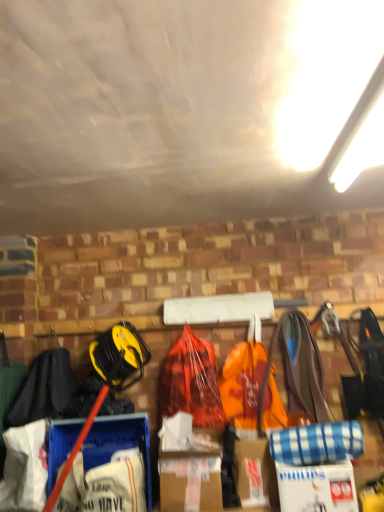
Question: Is white cardboard box at lower right wider than orange plastic bag at center?

Choices:
 (A) yes
 (B) no

Answer: (A)

Question: From the image's perspective, is white cardboard box at lower right on top of orange plastic bag at center?

Choices:
 (A) yes
 (B) no

Answer: (B)

Question: Is orange plastic bag at center at the back of white cardboard box at lower right?

Choices:
 (A) yes
 (B) no

Answer: (B)

Question: Considering the relative positions of white cardboard box at lower right and orange plastic bag at center in the image provided, is white cardboard box at lower right to the left of orange plastic bag at center from the viewer's perspective?

Choices:
 (A) yes
 (B) no

Answer: (B)

Question: Is white cardboard box at lower right bigger than orange plastic bag at center?

Choices:
 (A) no
 (B) yes

Answer: (A)

Question: From a real-world perspective, is white cardboard box at lower right on orange plastic bag at center?

Choices:
 (A) no
 (B) yes

Answer: (A)

Question: Is orange plastic bag at center closer to camera compared to white cardboard box at lower right?

Choices:
 (A) no
 (B) yes

Answer: (A)

Question: Is orange plastic bag at center outside white cardboard box at lower right?

Choices:
 (A) yes
 (B) no

Answer: (A)

Question: From a real-world perspective, is orange plastic bag at center on white cardboard box at lower right?

Choices:
 (A) yes
 (B) no

Answer: (A)

Question: Considering the relative positions of orange plastic bag at center and white cardboard box at lower right in the image provided, is orange plastic bag at center to the left of white cardboard box at lower right from the viewer's perspective?

Choices:
 (A) yes
 (B) no

Answer: (A)

Question: Considering the relative sizes of orange plastic bag at center and white cardboard box at lower right in the image provided, is orange plastic bag at center bigger than white cardboard box at lower right?

Choices:
 (A) no
 (B) yes

Answer: (B)

Question: From the image's perspective, would you say orange plastic bag at center is shown under white cardboard box at lower right?

Choices:
 (A) yes
 (B) no

Answer: (B)

Question: Is black fabric at left to the left of orange plastic bag at center from the viewer's perspective?

Choices:
 (A) no
 (B) yes

Answer: (B)